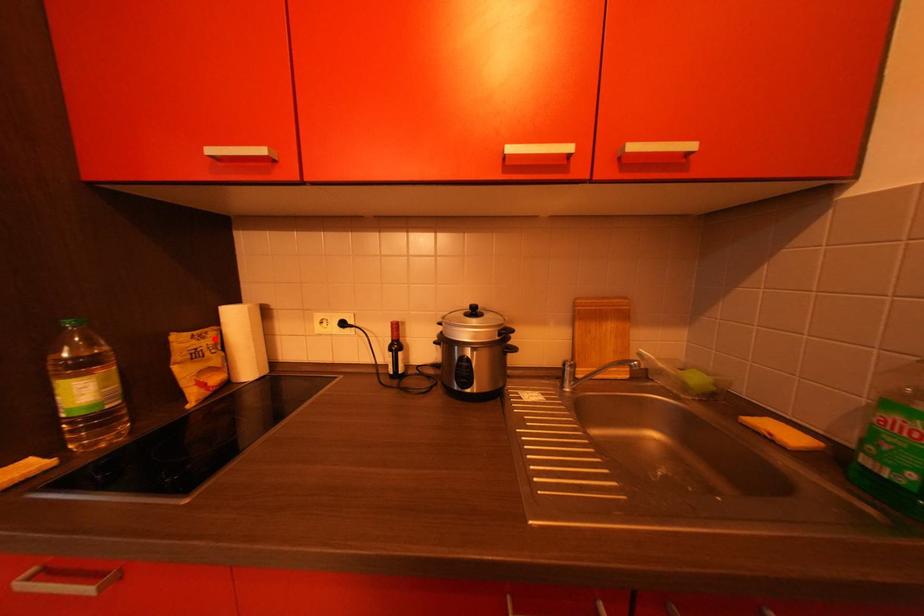
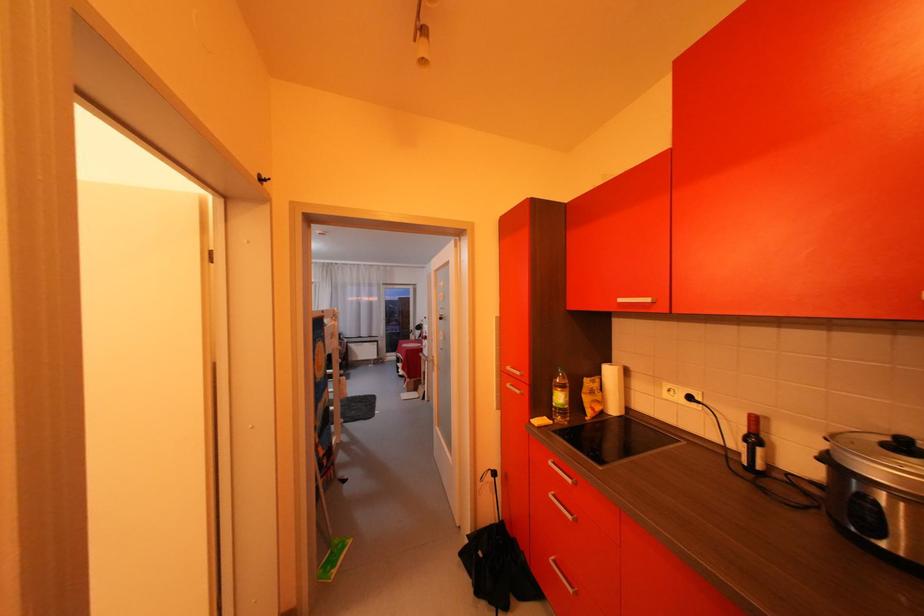
Question: A red point is marked in image1. In image2, is the corresponding 3D point closer to the camera or farther? Reply with the corresponding letter.

Choices:
 (A) The corresponding 3D point is closer.
 (B) The corresponding 3D point is farther.

Answer: (B)